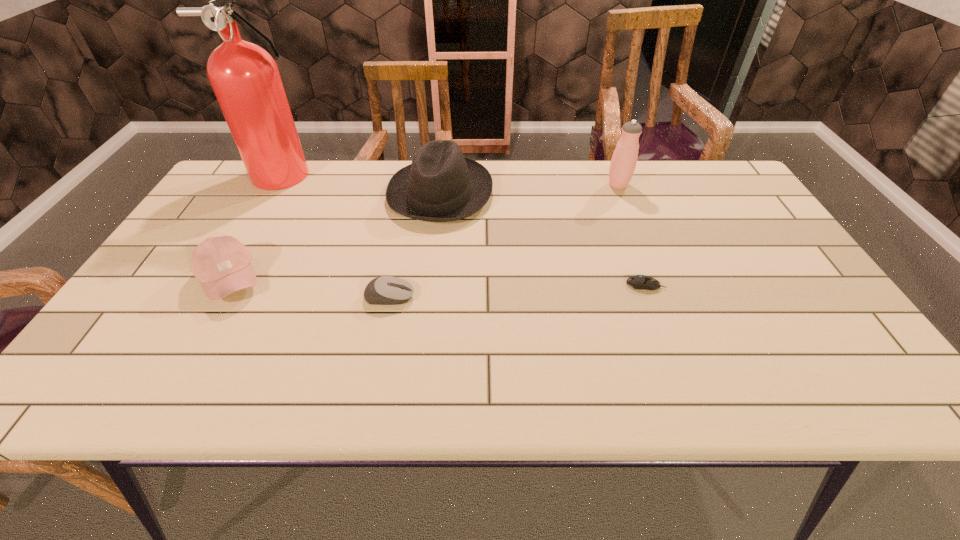
You are a GUI agent. You are given a task and a screenshot of the screen. Output one action in this format:
    pyautogui.click(x=<x>, y=<y>)
    Task: Click on the tallest object
    
    Given the screenshot: What is the action you would take?
    pyautogui.click(x=245, y=78)

Find the location of `thermos bottle`. thermos bottle is located at coordinates (623, 163).

Where is `the third tallest object`? This screenshot has width=960, height=540. the third tallest object is located at coordinates (441, 185).

Locate an element on the screen. the third shortest object is located at coordinates (222, 264).

I want to click on the second shortest object, so click(x=386, y=290).

You are a GUI agent. You are given a task and a screenshot of the screen. Output one action in this format:
    pyautogui.click(x=<x>, y=<y>)
    Task: Click on the taller computer mouse
    The width and height of the screenshot is (960, 540).
    Given the screenshot: What is the action you would take?
    pyautogui.click(x=386, y=290)

The height and width of the screenshot is (540, 960). I want to click on the right computer mouse, so click(x=640, y=282).

At what (x,y) coordinates should I click in order to perform the action: click on the shorter computer mouse. Please return your answer as a coordinate pair (x, y). This screenshot has height=540, width=960. Looking at the image, I should click on (640, 282).

Identify the location of vacant space located on the front of the tallest object. (253, 242).

Locate an element on the screen. The image size is (960, 540). vacant region located 0.060m on the right of the fifth shortest object is located at coordinates (650, 185).